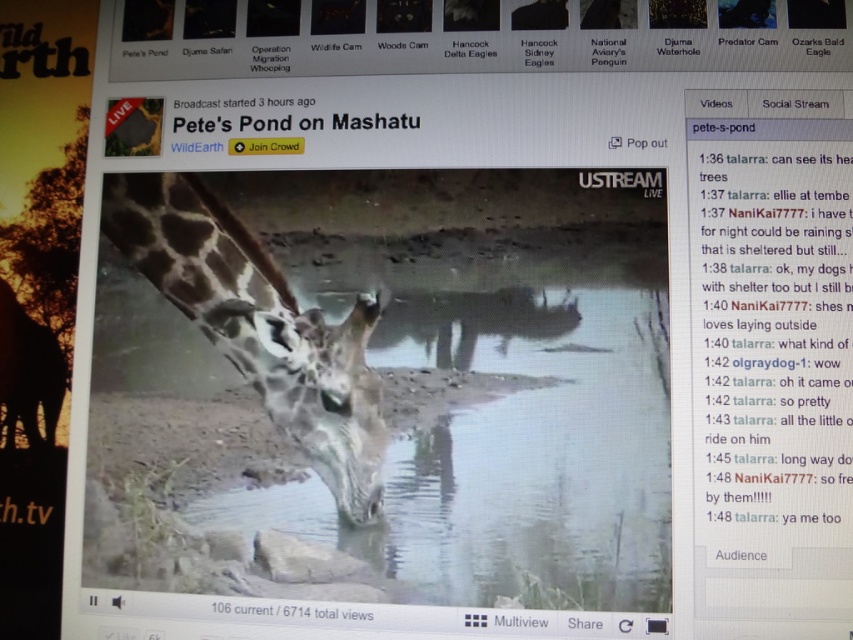
Question: Which point is closer to the camera?

Choices:
 (A) clear water at center
 (B) spotted fur giraffe at center

Answer: (A)

Question: Which of the following is the farthest from the observer?

Choices:
 (A) clear water at center
 (B) spotted fur giraffe at center

Answer: (B)

Question: From the image, what is the correct spatial relationship of clear water at center in relation to spotted fur giraffe at center?

Choices:
 (A) right
 (B) left

Answer: (A)

Question: From the image, what is the correct spatial relationship of clear water at center in relation to spotted fur giraffe at center?

Choices:
 (A) below
 (B) above

Answer: (A)

Question: Which point is closer to the camera?

Choices:
 (A) (399, 476)
 (B) (283, 320)

Answer: (A)

Question: Can you confirm if clear water at center is positioned to the left of spotted fur giraffe at center?

Choices:
 (A) yes
 (B) no

Answer: (B)